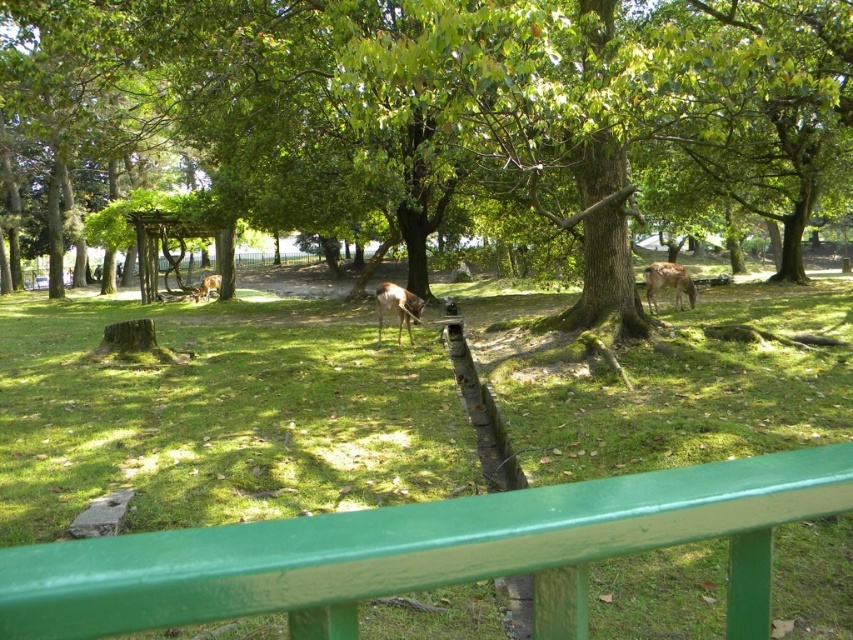
Question: Does brown matte/deer at center have a greater width compared to brown matte deer at center?

Choices:
 (A) no
 (B) yes

Answer: (A)

Question: Which point is farther from the camera taking this photo?

Choices:
 (A) (651, 284)
 (B) (195, 296)
 (C) (421, 305)
 (D) (592, 84)

Answer: (B)

Question: Can you confirm if green leafy tree at center is bigger than brown matte deer at center?

Choices:
 (A) no
 (B) yes

Answer: (B)

Question: Which point is closer to the camera taking this photo?

Choices:
 (A) (709, 484)
 (B) (677, 272)
 (C) (207, 285)
 (D) (409, 314)

Answer: (A)

Question: Can you confirm if green painted wood rail at lower center is positioned below brown matte deer at center?

Choices:
 (A) no
 (B) yes

Answer: (B)

Question: Which object is closer to the camera taking this photo?

Choices:
 (A) brown furry deer at center-right
 (B) brown matte deer at center
 (C) green leafy tree at center
 (D) brown matte/deer at center

Answer: (C)